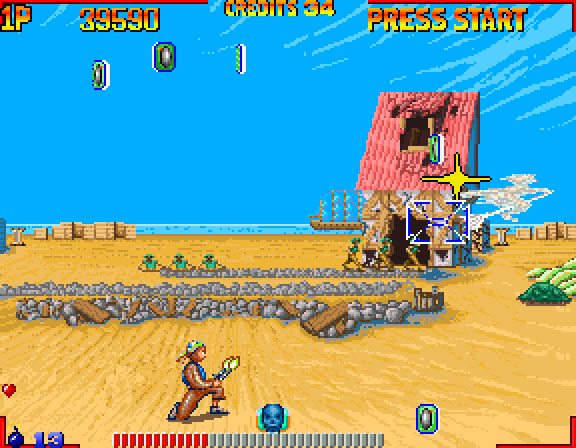
Identify the location of boxes. (98, 225), (120, 227), (128, 231), (63, 229), (43, 235).